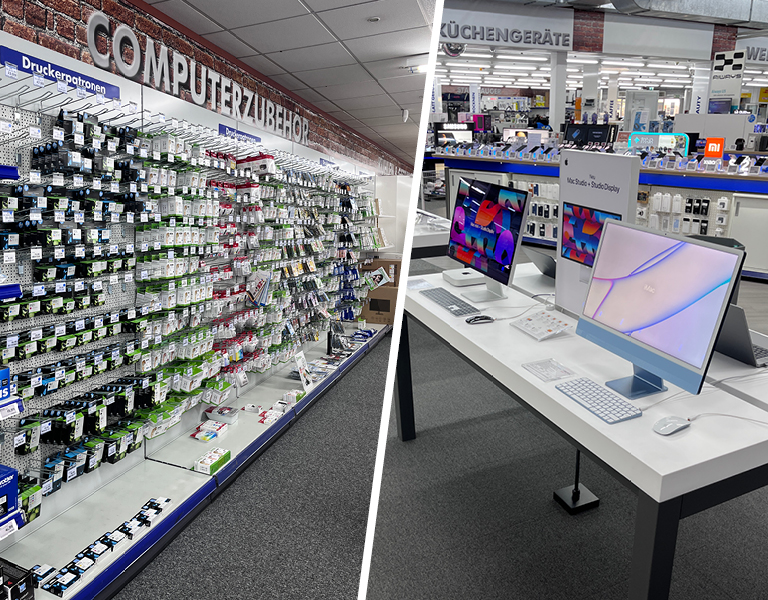
Where is `keyboard`? This screenshot has width=768, height=600. keyboard is located at coordinates (611, 408).